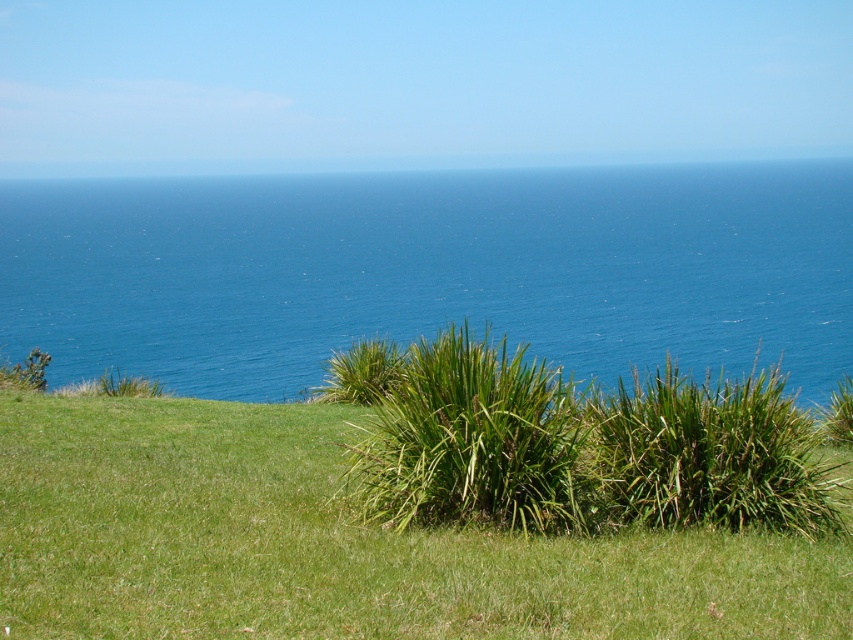
Which is below, blue water at center or green leafy shrub at center?

Positioned lower is green leafy shrub at center.

Who is taller, blue water at center or green leafy shrub at center?

With more height is blue water at center.

Locate an element on the screen. This screenshot has height=640, width=853. blue water at center is located at coordinates pos(431,269).

Where is `blue water at center`? blue water at center is located at coordinates (431, 269).

Looking at this image, does green grassy at lower center have a lesser height compared to green leafy shrub at center?

Correct, green grassy at lower center is not as tall as green leafy shrub at center.

Identify the location of green grassy at lower center. (337, 544).

Can you confirm if blue water at center is positioned below green grassy at lower center?

No.

Who is more forward, [256,202] or [567,561]?

Positioned in front is point [567,561].

Where is `blue water at center`? blue water at center is located at coordinates (431, 269).